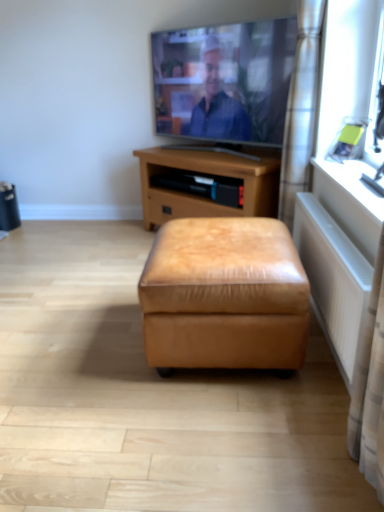
Question: Choose the correct answer: Is white plastic window sill at right inside satin silver curtain at right or outside it?

Choices:
 (A) outside
 (B) inside

Answer: (A)

Question: Is white plastic window sill at right in front of or behind satin silver curtain at right in the image?

Choices:
 (A) front
 (B) behind

Answer: (A)

Question: Estimate the real-world distances between objects in this image. Which object is closer to the matte silver tv at upper center?

Choices:
 (A) brown leather ottoman at center
 (B) white textured radiator at lower right
 (C) tan leather ottoman at center
 (D) white plastic window sill at right
 (E) satin silver curtain at right

Answer: (A)

Question: Which of these objects is positioned farthest from the white plastic window sill at right?

Choices:
 (A) matte silver tv at upper center
 (B) white textured radiator at lower right
 (C) tan leather ottoman at center
 (D) satin silver curtain at right
 (E) brown leather ottoman at center

Answer: (A)